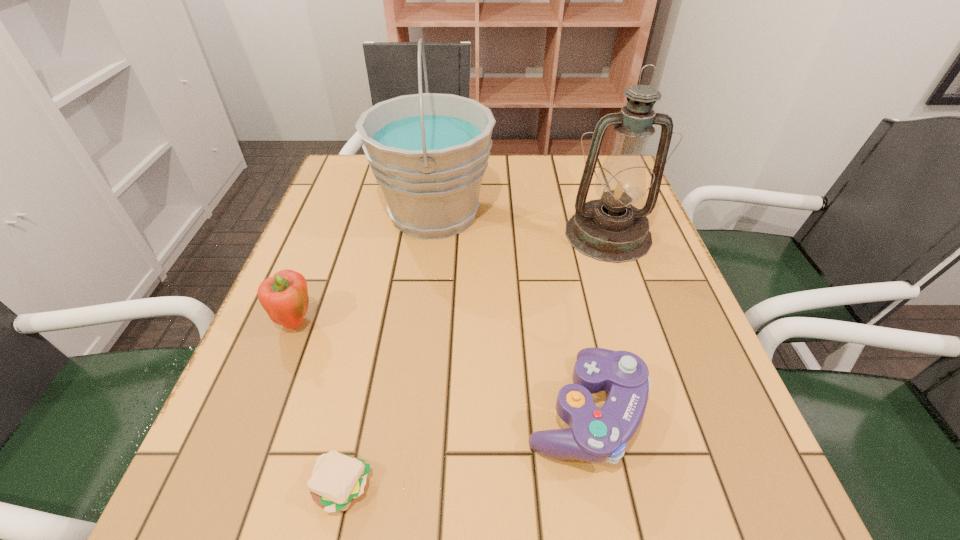
Locate an element on the screen. The height and width of the screenshot is (540, 960). free space between the pepper and the oil lamp is located at coordinates (451, 279).

Where is `empty location between the oil lamp and the second shortest object`? empty location between the oil lamp and the second shortest object is located at coordinates (596, 323).

Locate an element on the screen. vacant space in between the bucket and the pepper is located at coordinates (365, 268).

At what (x,y) coordinates should I click in order to perform the action: click on free area in between the pepper and the patty. Please return your answer as a coordinate pair (x, y). Looking at the image, I should click on (319, 405).

Where is `free point between the bucket and the leftmost object`? The height and width of the screenshot is (540, 960). free point between the bucket and the leftmost object is located at coordinates (365, 268).

Locate an element on the screen. The width and height of the screenshot is (960, 540). object that is the closest to the patty is located at coordinates (595, 435).

This screenshot has width=960, height=540. What are the coordinates of `object identified as the third closest to the oil lamp` in the screenshot? It's located at (284, 297).

Identify the location of free location that satisfies the following two spatial constraints: 1. on the back side of the shortest object; 2. on the right side of the bucket. The height and width of the screenshot is (540, 960). (401, 213).

You are a GUI agent. You are given a task and a screenshot of the screen. Output one action in this format:
    pyautogui.click(x=<x>, y=<y>)
    Task: Click on the free space that satisfies the following two spatial constraints: 1. on the back side of the oil lamp; 2. on the right side of the patty
    
    Given the screenshot: What is the action you would take?
    pyautogui.click(x=396, y=234)